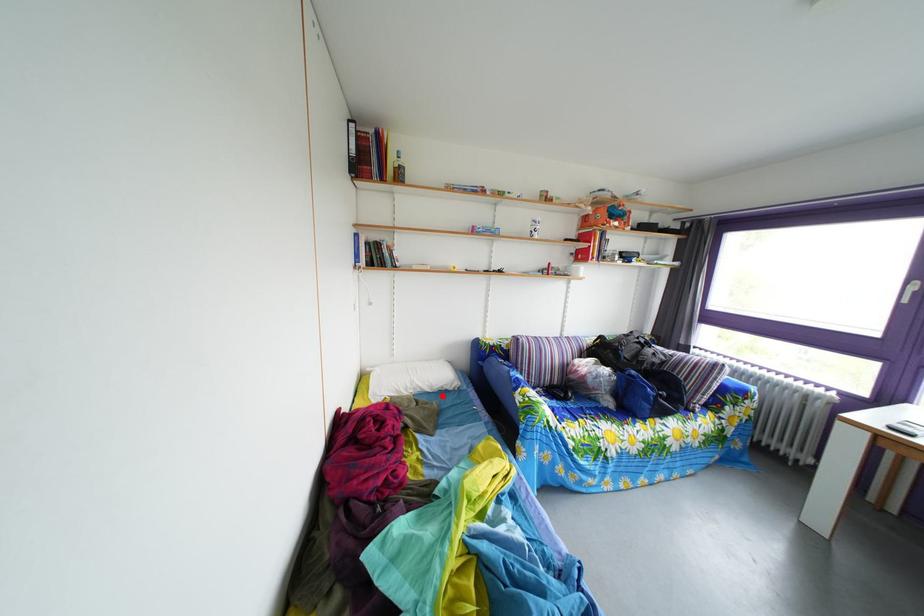
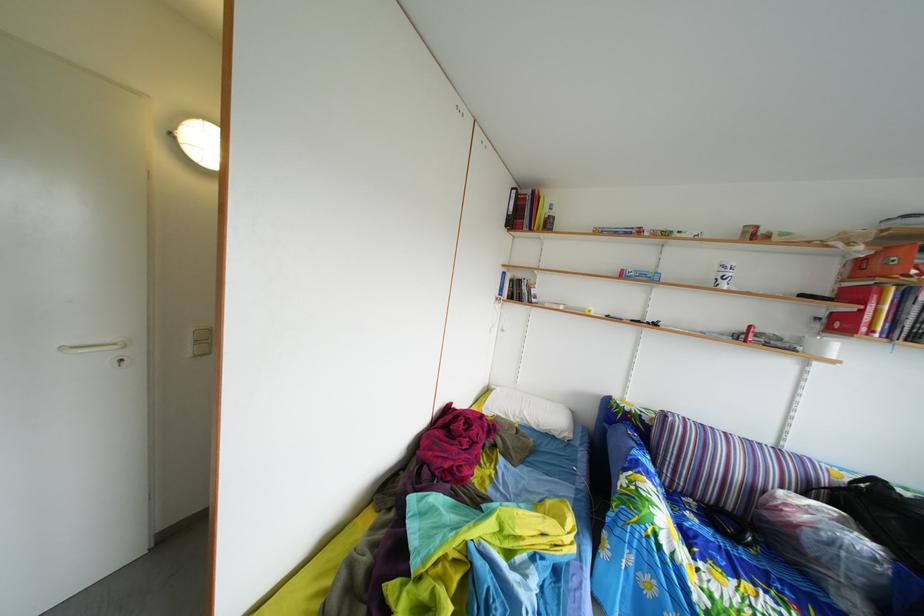
Where in the second image is the point corresponding to the highlighted location from the first image?

(549, 434)